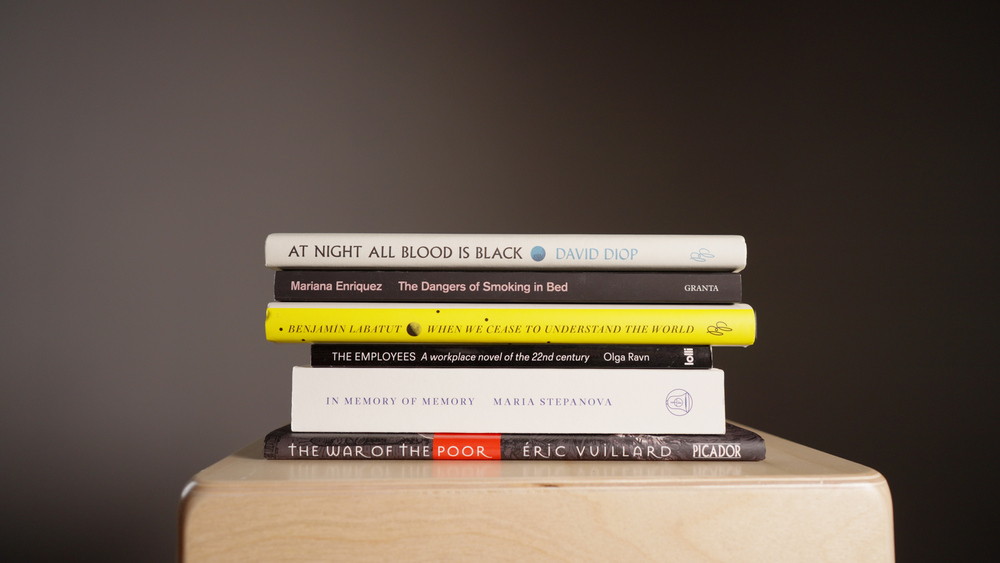
At what (x,y) coordinates should I click in order to perform the action: click on books. Please return your answer as a coordinate pair (x, y). Looking at the image, I should click on (496, 452), (512, 386), (529, 356), (539, 333), (566, 282), (582, 251).